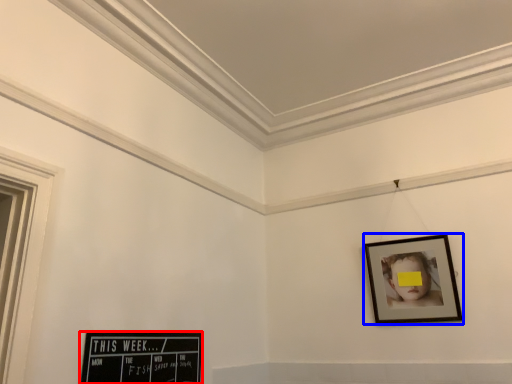
Question: Among these objects, which one is nearest to the camera, picture frame (highlighted by a red box) or picture frame (highlighted by a blue box)?

Choices:
 (A) picture frame
 (B) picture frame

Answer: (A)